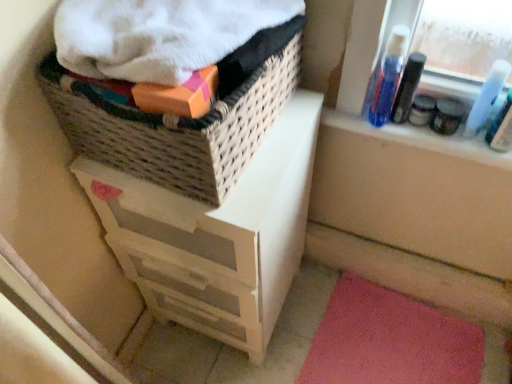
Question: From their relative heights in the image, would you say white painted wood chest of drawers at upper left is taller or shorter than blue plastic bottle at upper right, the second mouthwash from the left?

Choices:
 (A) tall
 (B) short

Answer: (A)

Question: Do you think white painted wood chest of drawers at upper left is within blue plastic bottle at upper right, the second mouthwash from the left, or outside of it?

Choices:
 (A) outside
 (B) inside

Answer: (A)

Question: Which object is positioned closest to the white painted wood chest of drawers at upper left?

Choices:
 (A) blue plastic bottle at upper right, acting as the 3th mouthwash starting from the right
 (B) translucent plastic mouthwash at upper right, the 3th mouthwash viewed from the left
 (C) matte black jar at upper right, the 1th toiletry positioned from the left
 (D) blue plastic bottle at upper right, the second mouthwash from the left
 (E) matte black container at upper right, which is the 1th toiletry from right to left

Answer: (A)

Question: Estimate the real-world distances between objects in this image. Which object is farther from the woven brown basket at upper left?

Choices:
 (A) matte black jar at upper right, positioned as the second toiletry in right-to-left order
 (B) pink carpet at lower right
 (C) translucent plastic mouthwash at upper right, acting as the first mouthwash starting from the right
 (D) blue plastic bottle at upper right, the 1th mouthwash in the left-to-right sequence
 (E) blue plastic bottle at upper right, the 2th mouthwash viewed from the right

Answer: (B)